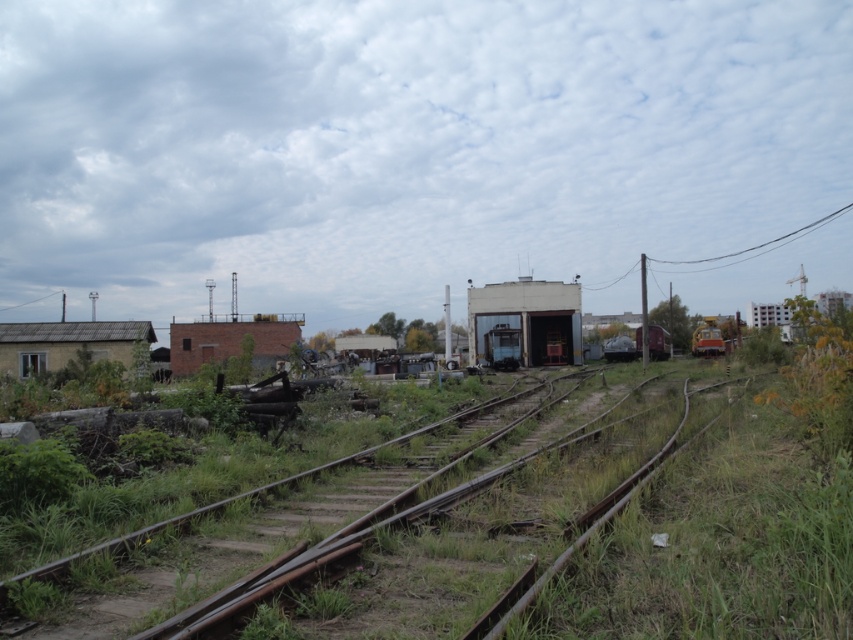
Is rusty metal track at center positioned in front of yellow metallic train car at right?

Yes, rusty metal track at center is closer to the viewer.

Locate an element on the screen. The width and height of the screenshot is (853, 640). rusty metal track at center is located at coordinates (566, 529).